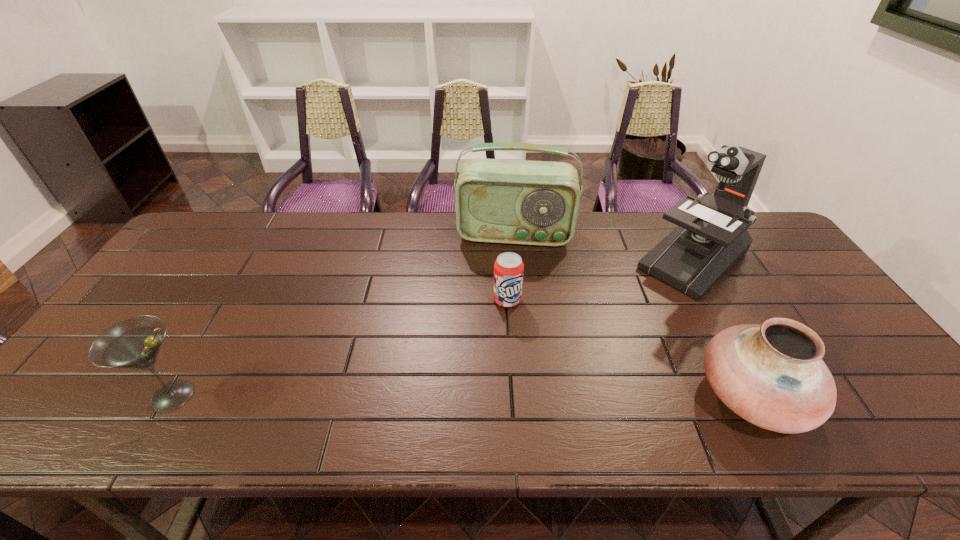
Where is `the leftmost object`? This screenshot has height=540, width=960. the leftmost object is located at coordinates (134, 343).

Locate an element on the screen. The height and width of the screenshot is (540, 960). pottery is located at coordinates (772, 375).

Find the location of `soda can`. soda can is located at coordinates (508, 268).

Where is `microscope`? microscope is located at coordinates (711, 237).

This screenshot has height=540, width=960. I want to click on radio receiver, so click(x=523, y=202).

You are a GUI agent. You are given a task and a screenshot of the screen. Output one action in this format:
    pyautogui.click(x=<x>, y=<y>)
    Task: Click on the blank space located on the back of the martini
    This screenshot has width=960, height=540.
    Given the screenshot: What is the action you would take?
    pyautogui.click(x=246, y=274)

What are the coordinates of `free space located 0.330m on the left of the pottery` in the screenshot? It's located at (552, 395).

Locate an element on the screen. The width and height of the screenshot is (960, 540). free space located 0.060m on the surface of the soda can is located at coordinates (515, 326).

At what (x,y) coordinates should I click in order to perform the action: click on vacant space located on the surface of the soda can. Please return your answer as a coordinate pair (x, y). Image resolution: width=960 pixels, height=540 pixels. Looking at the image, I should click on (526, 370).

Locate an element on the screen. This screenshot has width=960, height=540. vacant point located 0.090m on the surface of the soda can is located at coordinates (516, 335).